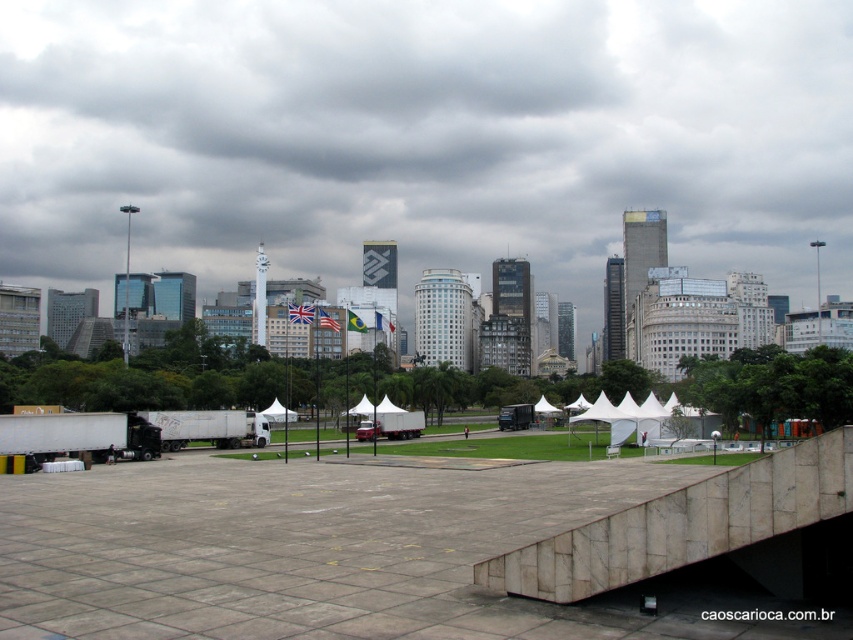
You are a drone operator who needs to fly a drone from the white marble ramp at lower center to the gray cloudy sky at upper center. Is the drone able to ascend vertically from the ramp to reach the sky?

The gray cloudy sky at upper center is above the white marble ramp at lower center, so yes, the drone can ascend vertically from the white marble ramp at lower center to reach the gray cloudy sky at upper center since it is positioned directly above.

You are a delivery person trying to reach the white fabric tent at center from the entrance located on the left side of the image. Is the white marble ramp at lower center on your right or left side as you walk towards the tent?

The white marble ramp at lower center is to the right of the white fabric tent at center, so as you walk towards the tent from the left side entrance, the ramp will be on your right side.

You are standing at the raised platform in the foreground of the city scene. You see two points marked in the image. Which point is closer to you, point (583,540) or point (276,404)?

Point (583,540) is closer to the viewer than point (276,404).